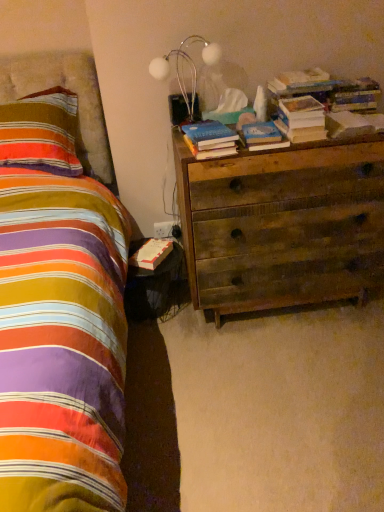
Where is `empty space that is ontop of hardcover book at center, arranged as the 2th paperback book when viewed from the right (from a real-world perspective)`? empty space that is ontop of hardcover book at center, arranged as the 2th paperback book when viewed from the right (from a real-world perspective) is located at coordinates (249, 125).